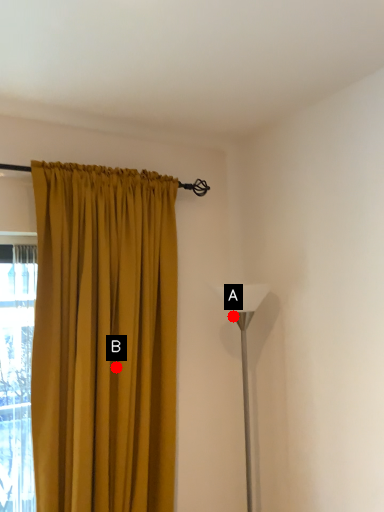
Question: Two points are circled on the image, labeled by A and B beside each circle. Which point appears closest to the camera in this image?

Choices:
 (A) A is closer
 (B) B is closer

Answer: (B)